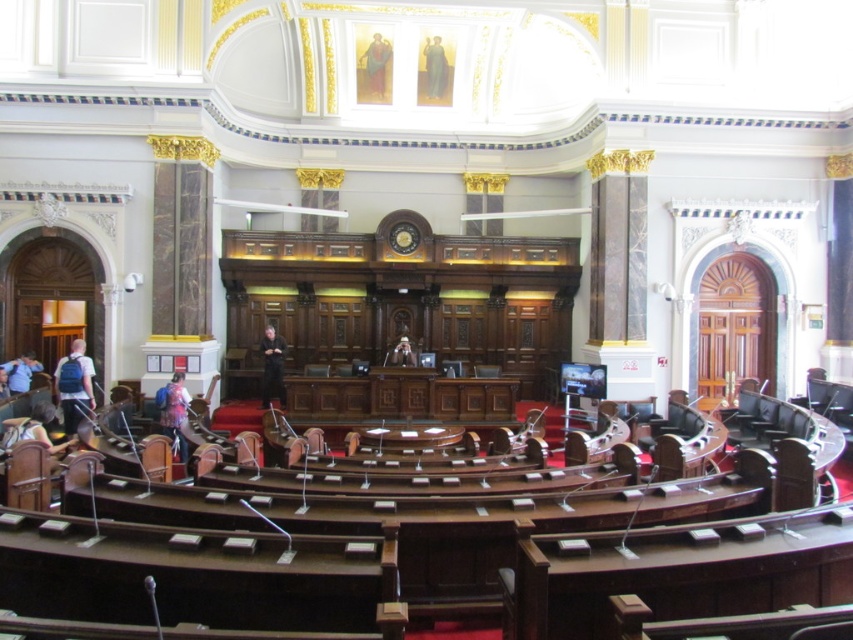
Question: Which of the following is the farthest from the observer?

Choices:
 (A) (370, 54)
 (B) (25, 390)

Answer: (A)

Question: Does blue fabric figure at upper center have a lesser width compared to blue fabric backpack at lower left?

Choices:
 (A) no
 (B) yes

Answer: (A)

Question: Among these points, which one is farthest from the camera?

Choices:
 (A) (262, 339)
 (B) (444, 81)
 (C) (28, 364)

Answer: (B)

Question: Is the position of dark brown leather coat at center more distant than that of white fabric at center?

Choices:
 (A) yes
 (B) no

Answer: (A)

Question: Which object appears closest to the camera in this image?

Choices:
 (A) blue fabric figure at upper center
 (B) denim jacket at lower left
 (C) blue backpack at left

Answer: (B)

Question: Can you confirm if matte blue backpack at left is wider than blue fabric figure at upper center?

Choices:
 (A) no
 (B) yes

Answer: (A)